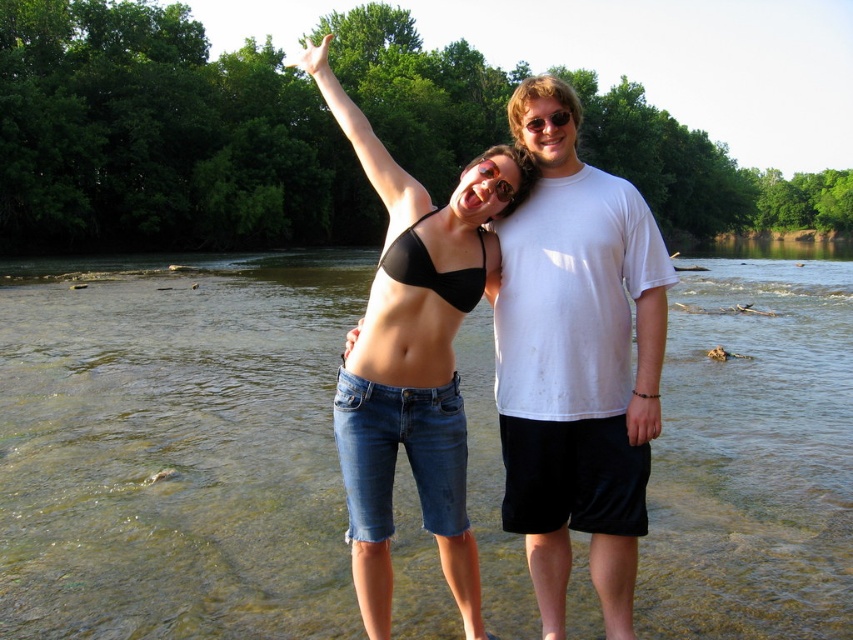
Question: Which of the following is the closest to the observer?

Choices:
 (A) (708, 612)
 (B) (469, 262)
 (C) (402, 269)
 (D) (618, 394)

Answer: (C)

Question: Is black denim shorts at center thinner than black matte bikini top at center?

Choices:
 (A) no
 (B) yes

Answer: (A)

Question: Does clear water at center come in front of black denim shorts at center?

Choices:
 (A) yes
 (B) no

Answer: (B)

Question: Does white cotton t-shirt at center appear over black denim shorts at center?

Choices:
 (A) yes
 (B) no

Answer: (B)

Question: Among these points, which one is nearest to the camera?

Choices:
 (A) (564, 426)
 (B) (497, 198)
 (C) (125, 506)

Answer: (A)

Question: Which point is closer to the camera?

Choices:
 (A) black matte bikini top at center
 (B) black denim shorts at center
 (C) clear water at center

Answer: (A)